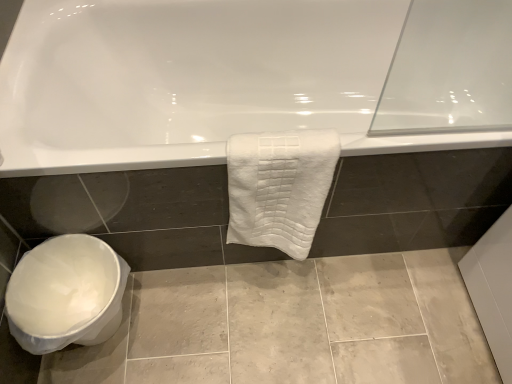
You are a GUI agent. You are given a task and a screenshot of the screen. Output one action in this format:
    pyautogui.click(x=<x>, y=<y>)
    Task: Click on the free spot above white textured towel at center (from a real-world perspective)
    This screenshot has height=384, width=512.
    Given the screenshot: What is the action you would take?
    pyautogui.click(x=279, y=144)